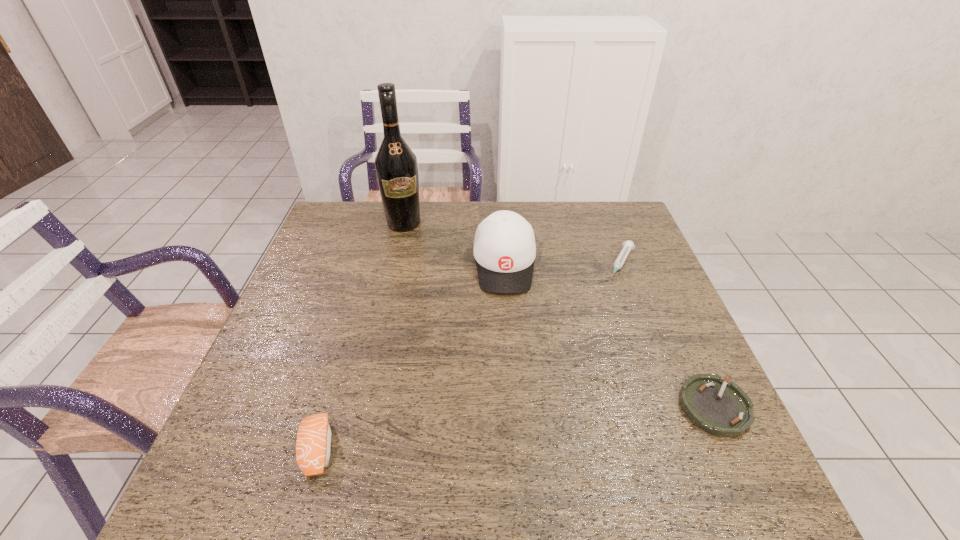
Where is `vacant space on the desktop that is between the third shortest object and the ashtray and is positioned at the needle end of the syringe`? The image size is (960, 540). vacant space on the desktop that is between the third shortest object and the ashtray and is positioned at the needle end of the syringe is located at coordinates (535, 426).

Where is `free space on the desktop that is between the sushi and the ashtray and is positioned on the front-facing side of the third object from left to right`? This screenshot has width=960, height=540. free space on the desktop that is between the sushi and the ashtray and is positioned on the front-facing side of the third object from left to right is located at coordinates (512, 428).

This screenshot has height=540, width=960. I want to click on vacant space on the desktop that is between the sushi and the ashtray and is positioned on the label of the farthest object, so click(x=475, y=432).